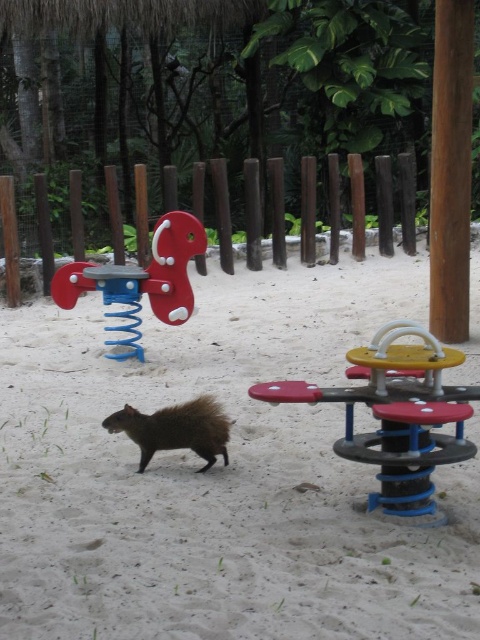
Question: Is white sandy ground at center in front of brown fuzzy squirrel at center?

Choices:
 (A) no
 (B) yes

Answer: (B)

Question: Based on their relative distances, which object is farther from the yellow plastic seesaw at center?

Choices:
 (A) matte plastic seesaw at left
 (B) brown fuzzy squirrel at center
 (C) white sandy ground at center

Answer: (A)

Question: Among these points, which one is farthest from the camera?

Choices:
 (A) (126, 285)
 (B) (431, 492)
 (C) (191, 410)
 (D) (112, 444)

Answer: (A)

Question: Which object is positioned closest to the white sandy ground at center?

Choices:
 (A) matte plastic seesaw at left
 (B) brown fuzzy squirrel at center
 (C) yellow plastic seesaw at center

Answer: (C)

Question: Does white sandy ground at center appear on the left side of yellow plastic seesaw at center?

Choices:
 (A) yes
 (B) no

Answer: (A)

Question: Is white sandy ground at center positioned at the back of matte plastic seesaw at left?

Choices:
 (A) no
 (B) yes

Answer: (A)